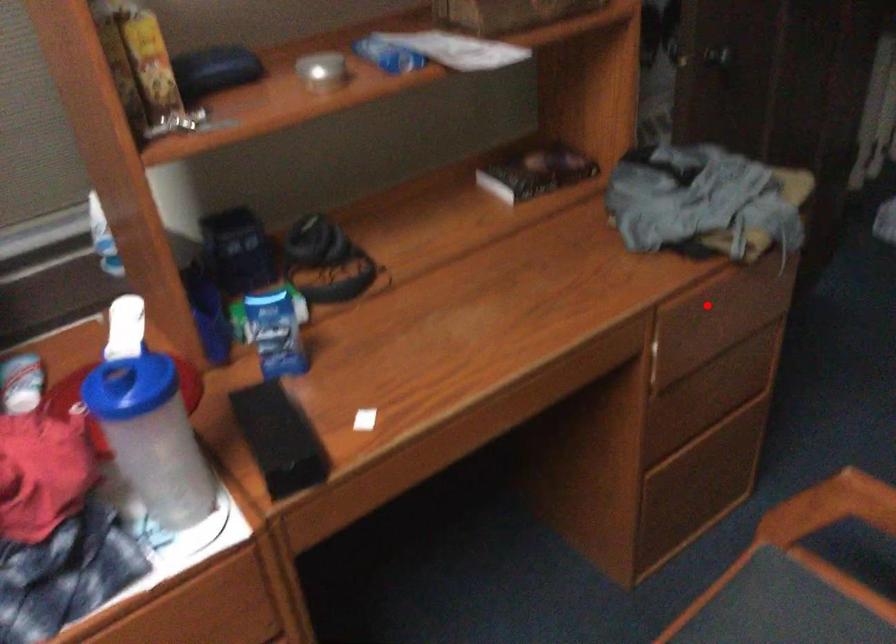
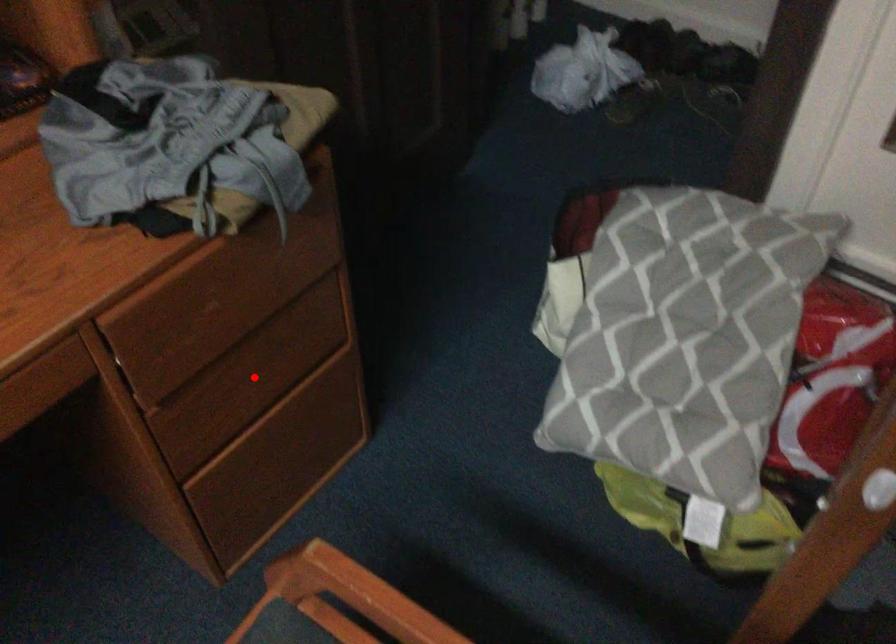
I am providing you with two images of the same scene from different viewpoints. A red point is marked on the first image and another point is marked on the second image. Do the highlighted points in image1 and image2 indicate the same real-world spot?

No